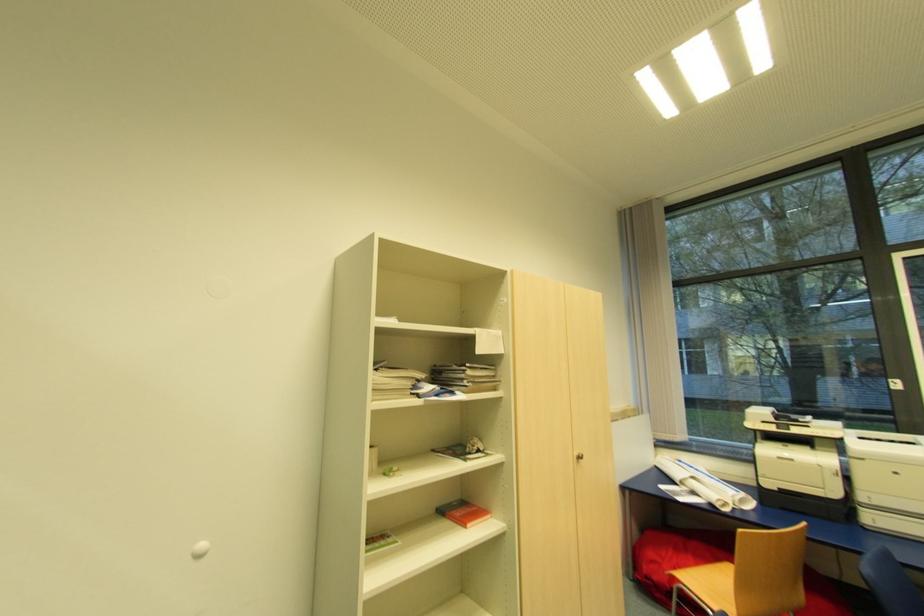
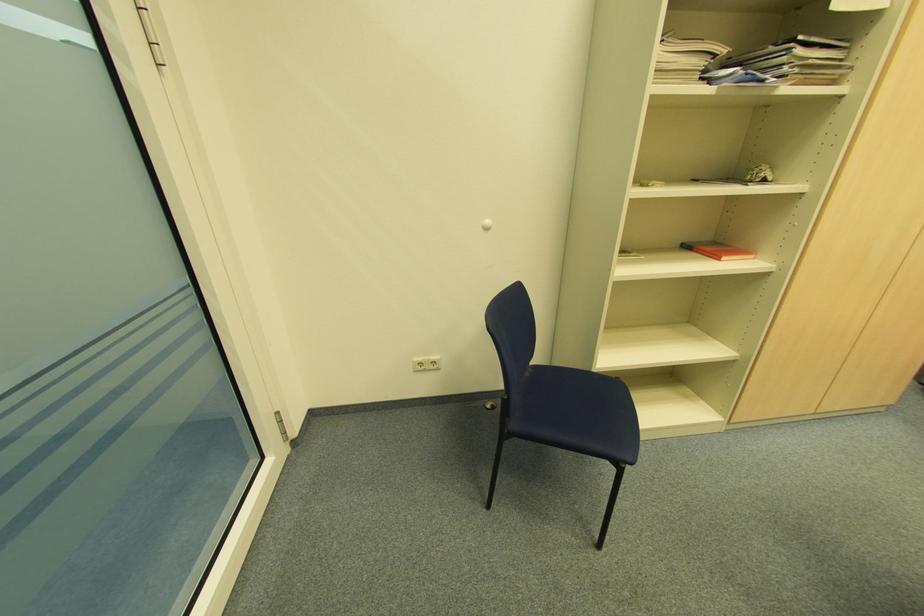
The point at [470,525] is marked in the first image. Where is the corresponding point in the second image?

(726, 257)